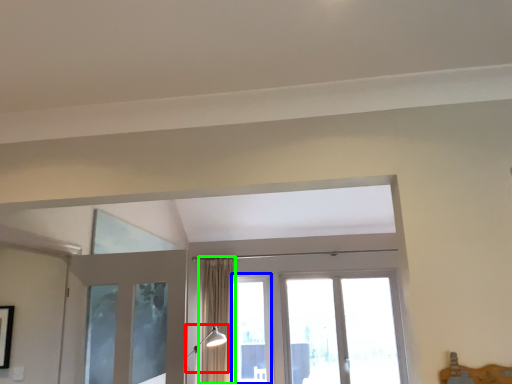
Question: Which object is positioned closest to light fixture (highlighted by a red box)? Select from window (highlighted by a blue box) and curtain (highlighted by a green box).

Choices:
 (A) window
 (B) curtain

Answer: (B)